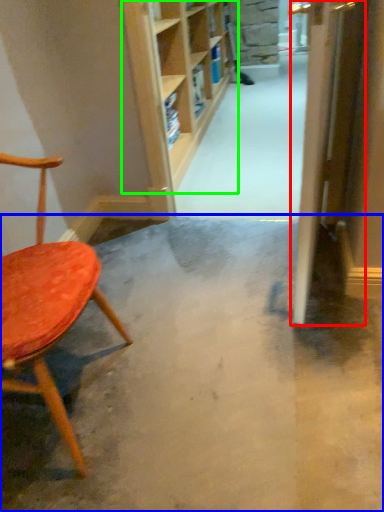
Question: Considering the real-world distances, which object is farthest from door (highlighted by a red box)? concrete (highlighted by a blue box) or shelf (highlighted by a green box)?

Choices:
 (A) concrete
 (B) shelf

Answer: (B)